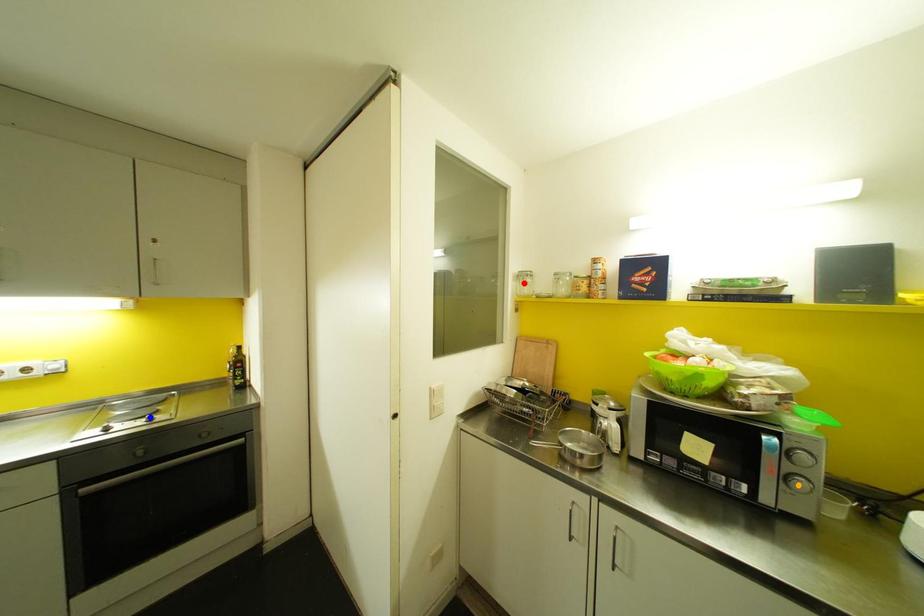
Order these from nearest to farthest:
blue point, red point, orange point

1. orange point
2. blue point
3. red point